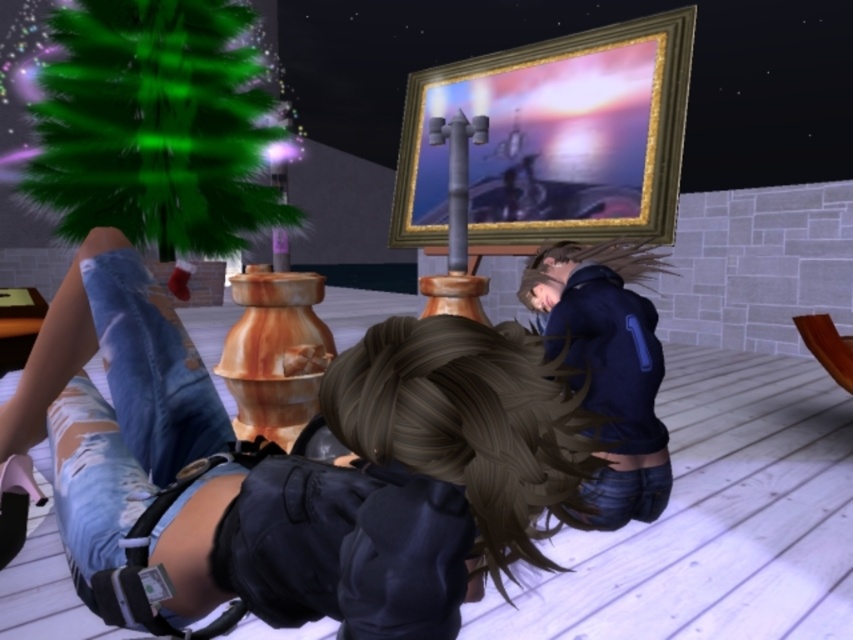
You are a character in the game and need to determine the distance between two points in the scene. The first point is at coordinates point (229, 164) and the second point is at coordinates point (561, 465). Which point is closer to you?

Point (229, 164) is closer to you because it is further to the camera than point (561, 465).

You are a drone operator trying to capture a closeup shot of two points in the scene. The points are labeled as point [421,355] and point [606,436]. Given that you want to focus on the point that is closer to the camera, which point should you choose?

Point [421,355] is closer to the camera than point [606,436], so you should choose point [421,355] to focus on for the closeup shot.